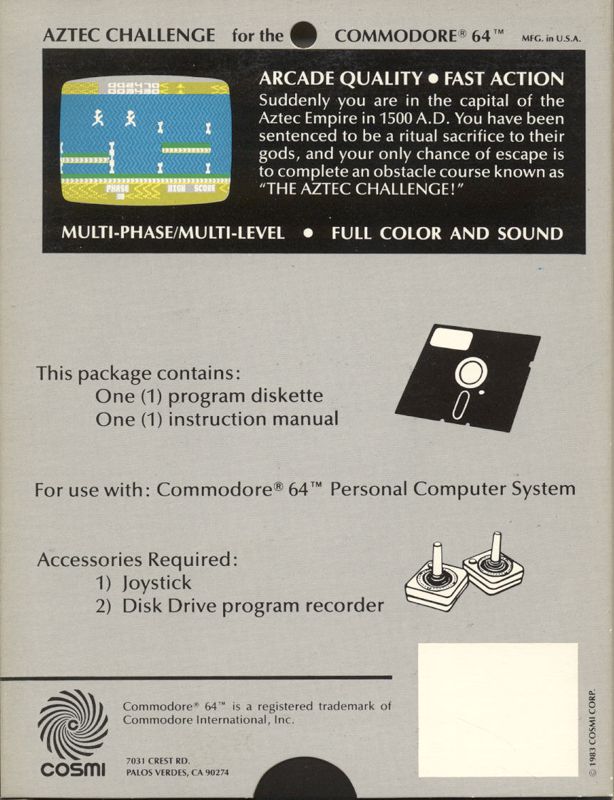
Identify the location of computer disk. The height and width of the screenshot is (800, 614). (482, 378).